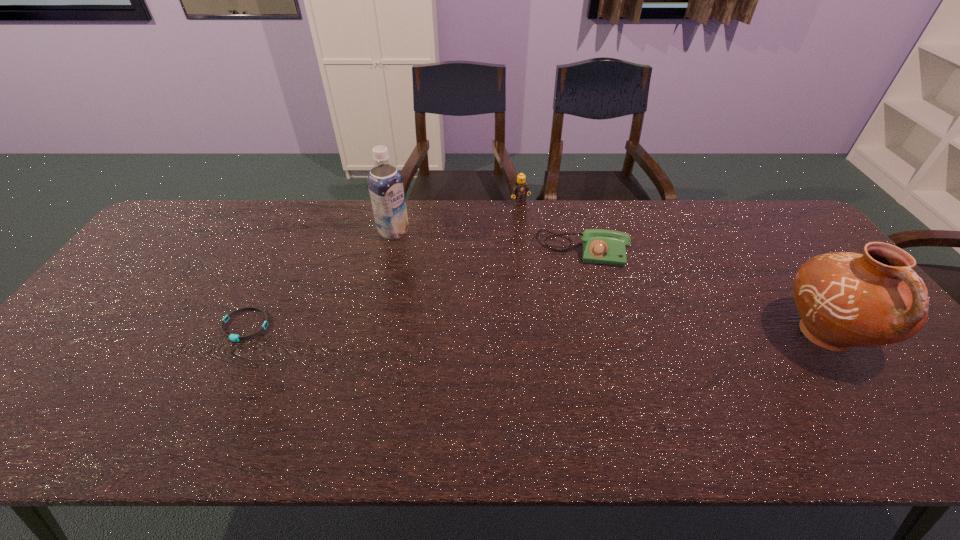
Find the location of a particular element. The height and width of the screenshot is (540, 960). the shortest object is located at coordinates (233, 337).

Image resolution: width=960 pixels, height=540 pixels. What are the coordinates of `wristband` in the screenshot? It's located at (233, 337).

Locate an element on the screen. This screenshot has width=960, height=540. pottery is located at coordinates (x=845, y=299).

This screenshot has height=540, width=960. What are the coordinates of `the second object from left to right` in the screenshot? It's located at (385, 183).

Where is `the fourth tallest object`? Image resolution: width=960 pixels, height=540 pixels. the fourth tallest object is located at coordinates tap(600, 246).

This screenshot has height=540, width=960. I want to click on Lego, so click(x=520, y=190).

Where is `the farthest object`? The width and height of the screenshot is (960, 540). the farthest object is located at coordinates (520, 190).

Where is `free space located on the buckle of the shortest object`? free space located on the buckle of the shortest object is located at coordinates (224, 370).

Where is `free space located on the label of the second object from left to right`? Image resolution: width=960 pixels, height=540 pixels. free space located on the label of the second object from left to right is located at coordinates (461, 275).

Image resolution: width=960 pixels, height=540 pixels. I want to click on vacant area situated 0.290m on the label of the second object from left to right, so click(x=471, y=282).